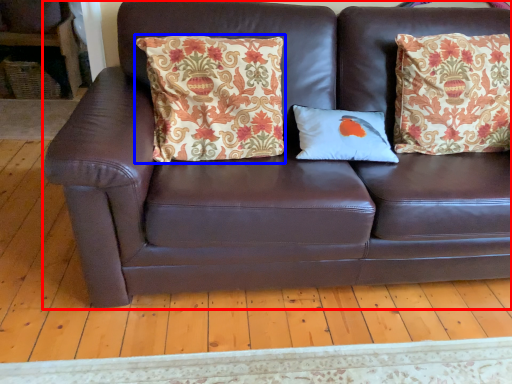
Question: Which point is closer to the camera, studio couch (highlighted by a red box) or pillow (highlighted by a blue box)?

Choices:
 (A) studio couch
 (B) pillow

Answer: (A)